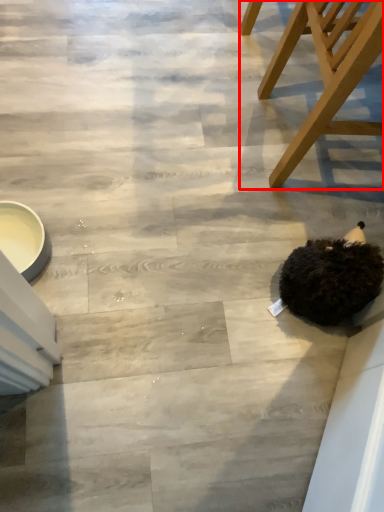
Question: Observing the image, what is the correct spatial positioning of chair (annotated by the red box) in reference to animal?

Choices:
 (A) right
 (B) left

Answer: (A)